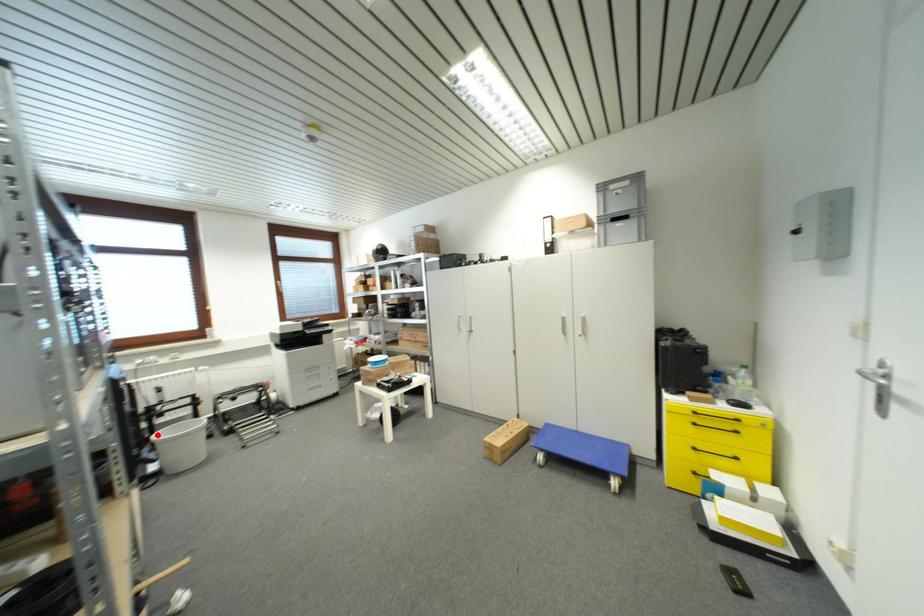
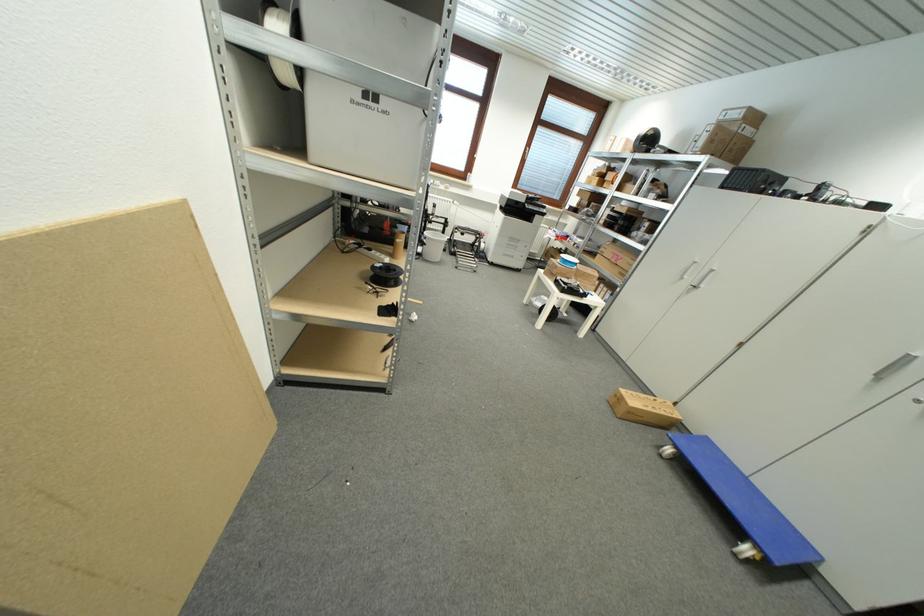
In the second image, find the point that corresponds to the highlighted location in the first image.

(430, 233)